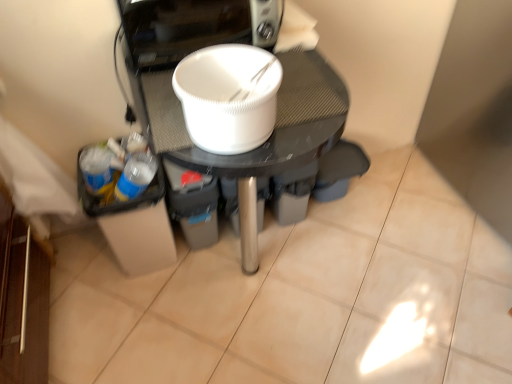
The height and width of the screenshot is (384, 512). What are the coordinates of `vacant region under white matte bowl at center (from a real-world perspective)` in the screenshot? It's located at (251, 281).